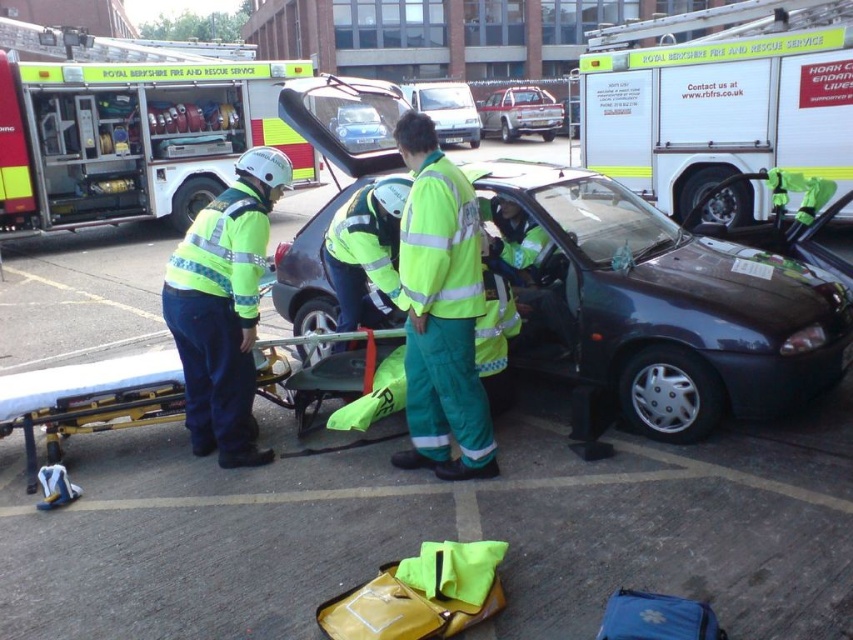
Between green reflective jacket at center and metallic silver pickup truck at center, which one appears on the right side from the viewer's perspective?

From the viewer's perspective, metallic silver pickup truck at center appears more on the right side.

Is point (344, 252) farther from viewer compared to point (521, 109)?

No, (344, 252) is in front of (521, 109).

Locate an element on the screen. This screenshot has height=640, width=853. green reflective jacket at center is located at coordinates (364, 250).

Between high-visibility fabric uniform at center and metallic silver pickup truck at center, which one appears on the right side from the viewer's perspective?

metallic silver pickup truck at center

Who is taller, high-visibility fabric uniform at center or metallic silver pickup truck at center?

Standing taller between the two is metallic silver pickup truck at center.

This screenshot has height=640, width=853. Find the location of `high-visibility fabric uniform at center`. high-visibility fabric uniform at center is located at coordinates (440, 310).

Locate an element on the screen. Image resolution: width=853 pixels, height=640 pixels. high-visibility fabric uniform at center is located at coordinates (440, 310).

From the picture: Can you confirm if neon yellow reflective jacket at left is smaller than yellow fabric stretcher at lower left?

No, neon yellow reflective jacket at left is not smaller than yellow fabric stretcher at lower left.

Locate an element on the screen. The height and width of the screenshot is (640, 853). neon yellow reflective jacket at left is located at coordinates (223, 307).

This screenshot has height=640, width=853. What do you see at coordinates (223, 307) in the screenshot?
I see `neon yellow reflective jacket at left` at bounding box center [223, 307].

Locate an element on the screen. The height and width of the screenshot is (640, 853). neon yellow reflective jacket at left is located at coordinates (223, 307).